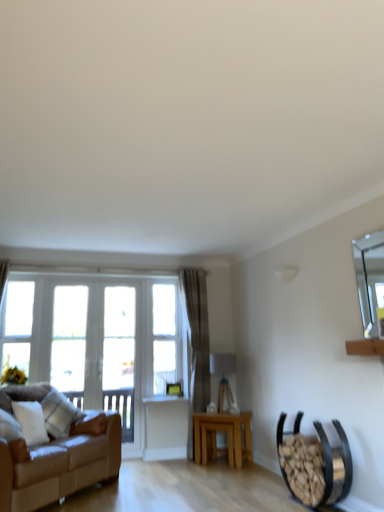
This screenshot has height=512, width=384. What are the coordinates of `white sheer curtain at left, the first curtain when ordered from left to right` in the screenshot? It's located at (3, 275).

Where is `brown leather couch at left`? This screenshot has height=512, width=384. brown leather couch at left is located at coordinates point(60,463).

Measure the distance between brown leather couch at left and camera.

A distance of 2.83 meters exists between brown leather couch at left and camera.

Describe the element at coordinates (30, 421) in the screenshot. Image resolution: width=384 pixels, height=512 pixels. I see `white soft pillow at lower left, the first pillow from the front` at that location.

You are a GUI agent. You are given a task and a screenshot of the screen. Output one action in this format:
    pyautogui.click(x=<x>, y=<y>)
    Task: Click on the matte gray curtain at center, acting as the 2th curtain starting from the left
    
    Given the screenshot: What is the action you would take?
    pyautogui.click(x=196, y=347)

The image size is (384, 512). In order to click on clear glass window at left, which is the second window from right to left in this screenshot , I will do `click(69, 341)`.

The height and width of the screenshot is (512, 384). What do you see at coordinates (69, 341) in the screenshot?
I see `clear glass window at left, positioned as the 2th window in left-to-right order` at bounding box center [69, 341].

What do you see at coordinates (119, 356) in the screenshot? The height and width of the screenshot is (512, 384). I see `white painted wood window frame at center` at bounding box center [119, 356].

What is the approximate width of white painted wood window frame at center?

17.19 centimeters.

This screenshot has height=512, width=384. Identify the location of white sheer curtain at left, the first curtain in the front-to-back sequence. (3, 275).

From the image's perspective, starting from the white painted wood window frame at center, which curtain is the 1st one above? Please provide its 2D coordinates.

[(196, 347)]

From the picture: How different are the orientations of white painted wood window frame at center and matte gray curtain at center, positioned as the 1th curtain in right-to-left order, in degrees?

They differ by 1.05 degrees in their facing directions.

Consider the image. From a real-world perspective, is white painted wood window frame at center over matte gray curtain at center, arranged as the 1th curtain when viewed from the back?

Incorrect, from a real-world perspective, white painted wood window frame at center is lower than matte gray curtain at center, arranged as the 1th curtain when viewed from the back.

Is white painted wood window frame at center positioned far away from matte gray curtain at center, acting as the 2th curtain starting from the left?

Actually, white painted wood window frame at center and matte gray curtain at center, acting as the 2th curtain starting from the left, are a little close together.

From the clear glass window at left, the 3th window from the right, count 2nd pillows forward and point to it. Please provide its 2D coordinates.

[(30, 421)]

Is white soft pillow at lower left, placed as the 2th pillow when sorted from back to front, facing away from clear glass window at left, placed as the 1th window when sorted from left to right?

No, white soft pillow at lower left, placed as the 2th pillow when sorted from back to front,'s orientation is not away from clear glass window at left, placed as the 1th window when sorted from left to right.

From a real-world perspective, is white soft pillow at lower left, placed as the 2th pillow when sorted from back to front, above or below clear glass window at left, the 3th window from the right?

From a real-world perspective, white soft pillow at lower left, placed as the 2th pillow when sorted from back to front, is physically below clear glass window at left, the 3th window from the right.

Considering the positions of point (36, 423) and point (13, 328), is point (36, 423) closer or farther from the camera than point (13, 328)?

Point (36, 423) is positioned closer to the camera compared to point (13, 328).

Does matte gray curtain at center, the 2th curtain positioned from the front, turn towards white wood glass door at left?

No, matte gray curtain at center, the 2th curtain positioned from the front, does not turn towards white wood glass door at left.

Where is `glass door below the matte gray curtain at center, the 2th curtain positioned from the front (from the image's perspective)`? The width and height of the screenshot is (384, 512). glass door below the matte gray curtain at center, the 2th curtain positioned from the front (from the image's perspective) is located at coordinates (100, 345).

Does matte gray curtain at center, positioned as the 1th curtain in right-to-left order, appear on the right side of white wood glass door at left?

Yes, matte gray curtain at center, positioned as the 1th curtain in right-to-left order, is to the right of white wood glass door at left.

In terms of height, does matte gray curtain at center, positioned as the 1th curtain in right-to-left order, look taller or shorter compared to white wood glass door at left?

Clearly, matte gray curtain at center, positioned as the 1th curtain in right-to-left order, is taller compared to white wood glass door at left.

Which object is wider, white sheer curtain at left, the first curtain when ordered from left to right, or clear glass window at center, arranged as the 3th window when viewed from the left?

white sheer curtain at left, the first curtain when ordered from left to right, is wider.

From a real-world perspective, which is physically above, white sheer curtain at left, the first curtain in the front-to-back sequence, or clear glass window at center, the 1th window from the right?

white sheer curtain at left, the first curtain in the front-to-back sequence.

Considering the relative positions of white sheer curtain at left, the first curtain when ordered from left to right, and clear glass window at center, the 1th window from the right, in the image provided, is white sheer curtain at left, the first curtain when ordered from left to right, in front of clear glass window at center, the 1th window from the right,?

That is True.

Is point (5, 277) in front of point (158, 289)?

Yes, it is in front of point (158, 289).

Who is bigger, light brown wooden table at center or plush white pillow at left, the second pillow when ordered from front to back?

light brown wooden table at center is bigger.

Is light brown wooden table at center far away from plush white pillow at left, the second pillow when ordered from front to back?

Yes, light brown wooden table at center and plush white pillow at left, the second pillow when ordered from front to back, are located far from each other.

Is light brown wooden table at center facing towards plush white pillow at left, which appears as the 1th pillow when viewed from the back?

No.

Would you say light brown wooden table at center is outside plush white pillow at left, the second pillow when ordered from front to back?

Yes, light brown wooden table at center is located beyond the bounds of plush white pillow at left, the second pillow when ordered from front to back.

Considering the sizes of clear glass window at center, arranged as the 3th window when viewed from the left, and clear glass window at left, the 3th window from the right, in the image, is clear glass window at center, arranged as the 3th window when viewed from the left, wider or thinner than clear glass window at left, the 3th window from the right,?

In the image, clear glass window at center, arranged as the 3th window when viewed from the left, appears to be wider than clear glass window at left, the 3th window from the right.

Measure the distance between clear glass window at center, the 1th window from the right, and clear glass window at left, the 3th window from the right.

1.58 meters.

Which point is more forward, (174, 309) or (25, 327)?

Positioned in front is point (25, 327).

From a real-world perspective, is clear glass window at center, arranged as the 3th window when viewed from the left, positioned under clear glass window at left, placed as the 1th window when sorted from left to right, based on gravity?

Yes.

Is point (219, 425) more distant than point (73, 307)?

No, (219, 425) is closer to viewer.

Does light brown wooden table at center have a smaller size compared to clear glass window at left, which is the second window from right to left?

Yes.

What's the angular difference between light brown wooden table at center and clear glass window at left, positioned as the 2th window in left-to-right order,'s facing directions?

A: 45.1 degrees separate the facing orientations of light brown wooden table at center and clear glass window at left, positioned as the 2th window in left-to-right order.

From a real-world perspective, which is physically above, light brown wooden table at center or clear glass window at left, positioned as the 2th window in left-to-right order?

From a 3D spatial view, clear glass window at left, positioned as the 2th window in left-to-right order, is above.

At what (x,y) coordinates should I click in order to perform the action: click on window frame that is under the matte gray curtain at center, the 2th curtain positioned from the front (from a real-world perspective). Please return your answer as a coordinate pair (x, y). Looking at the image, I should click on (119, 356).

Starting from the white soft pillow at lower left, placed as the 2th pillow when sorted from back to front, which window is the 1st one behind? Please provide its 2D coordinates.

[(17, 325)]

Looking at the image, which one is located closer to clear glass window at center, the 1th window from the right, matte gray curtain at center, arranged as the 1th curtain when viewed from the back, or white wood glass door at left?

Based on the image, matte gray curtain at center, arranged as the 1th curtain when viewed from the back, appears to be nearer to clear glass window at center, the 1th window from the right.

Estimate the real-world distances between objects in this image. Which object is further from plush white pillow at left, the second pillow when ordered from front to back, white painted wood window frame at center or white wood glass door at left?

white painted wood window frame at center is positioned further to the anchor plush white pillow at left, the second pillow when ordered from front to back.

From the image, which object appears to be farther from clear glass window at left, which is the second window from right to left, light brown wooden table at center or white sheer curtain at left, the first curtain when ordered from left to right?

The object further to clear glass window at left, which is the second window from right to left, is light brown wooden table at center.

Estimate the real-world distances between objects in this image. Which object is closer to clear glass window at center, arranged as the 3th window when viewed from the left, brown leather couch at left or white sheer curtain at left, placed as the second curtain when sorted from back to front?

Based on the image, brown leather couch at left appears to be nearer to clear glass window at center, arranged as the 3th window when viewed from the left.

Considering their positions, is brown leather couch at left positioned closer to matte gray curtain at center, acting as the 2th curtain starting from the left, than clear glass window at left, which is the second window from right to left?

clear glass window at left, which is the second window from right to left, is closer to matte gray curtain at center, acting as the 2th curtain starting from the left.

Based on their spatial positions, is clear glass window at left, the 3th window from the right, or matte gray curtain at center, arranged as the 1th curtain when viewed from the back, further from white wood glass door at left?

matte gray curtain at center, arranged as the 1th curtain when viewed from the back.

Estimate the real-world distances between objects in this image. Which object is closer to matte gray curtain at center, positioned as the 1th curtain in right-to-left order, light brown wooden table at center or clear glass window at left, which is the second window from right to left?

The object closer to matte gray curtain at center, positioned as the 1th curtain in right-to-left order, is light brown wooden table at center.

Which object lies further to the anchor point matte gray curtain at center, acting as the 2th curtain starting from the left, clear glass window at left, placed as the 1th window when sorted from left to right, or white painted wood window frame at center?

clear glass window at left, placed as the 1th window when sorted from left to right, is positioned further to the anchor matte gray curtain at center, acting as the 2th curtain starting from the left.

This screenshot has width=384, height=512. What are the coordinates of `glass door situated between white sheer curtain at left, placed as the second curtain when sorted from back to front, and matte gray curtain at center, positioned as the 1th curtain in right-to-left order, from left to right` in the screenshot? It's located at [100, 345].

Identify the location of window between clear glass window at left, the 3th window from the right, and white painted wood window frame at center from left to right. (69, 341).

Where is `pillow between white soft pillow at lower left, placed as the 2th pillow when sorted from back to front, and white wood glass door at left in the front-back direction`? The width and height of the screenshot is (384, 512). pillow between white soft pillow at lower left, placed as the 2th pillow when sorted from back to front, and white wood glass door at left in the front-back direction is located at coordinates (59, 414).

Find the location of `curtain between white wood glass door at left and light brown wooden table at center in the horizontal direction`. curtain between white wood glass door at left and light brown wooden table at center in the horizontal direction is located at coordinates (196, 347).